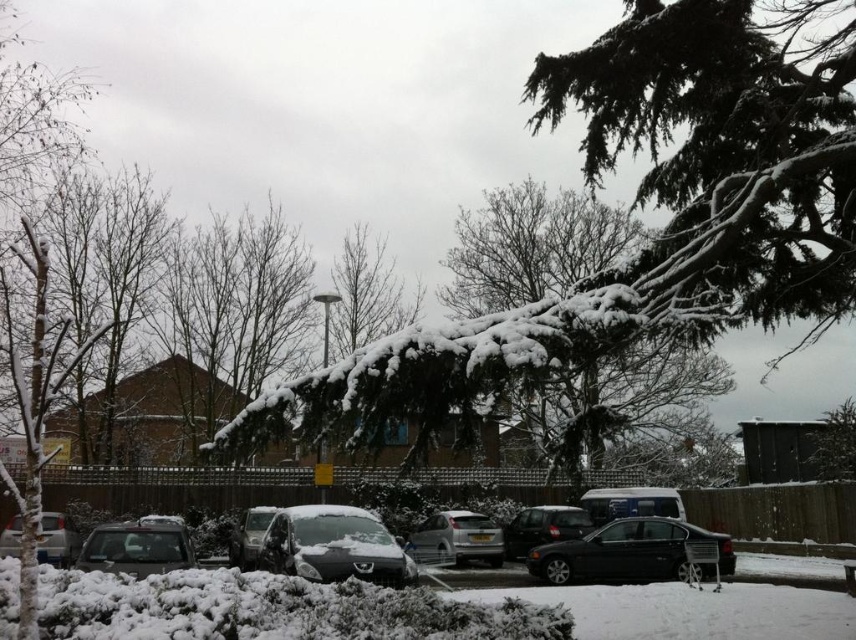
Question: Among these points, which one is farthest from the camera?

Choices:
 (A) pos(183,552)
 (B) pos(551,577)
 (C) pos(480,538)
 (D) pos(74,557)

Answer: (C)

Question: Based on their relative distances, which object is nearer to the shiny black car at center?

Choices:
 (A) sleek silver sedan at lower left
 (B) satin silver car at center
 (C) shiny black sedan at center

Answer: (B)

Question: Among these points, which one is nearest to the camera?

Choices:
 (A) (519, 552)
 (B) (229, 538)

Answer: (A)

Question: Is satin silver car at center to the right of sleek silver sedan at center from the viewer's perspective?

Choices:
 (A) yes
 (B) no

Answer: (A)

Question: Does sleek metallic car at center have a greater width compared to satin silver car at center?

Choices:
 (A) no
 (B) yes

Answer: (B)

Question: Is sleek metallic car at center behind sleek silver sedan at center?

Choices:
 (A) no
 (B) yes

Answer: (A)